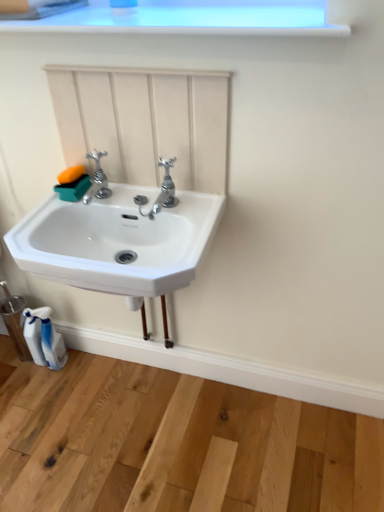
Identify the location of empty space that is in between polished chrome faucet at center, which appears as the 2th tap when viewed from the left, and polished chrome tap at center, the 1th tap viewed from the left. (131, 201).